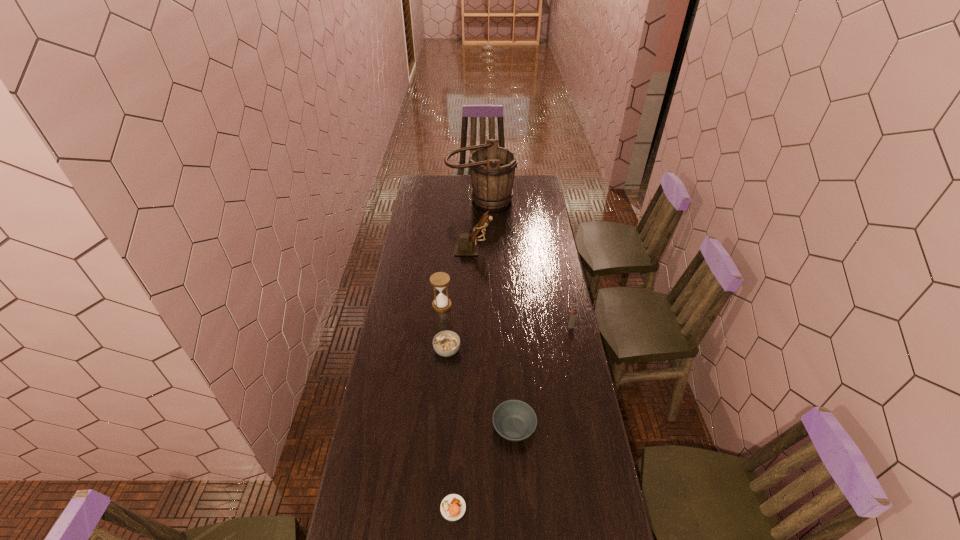
Locate an element on the screen. the right soup bowl is located at coordinates (514, 420).

Find the location of a particular element. The width and height of the screenshot is (960, 540). the second nearest object is located at coordinates (514, 420).

Find the location of `the shortest object`. the shortest object is located at coordinates (453, 507).

I want to click on patty, so click(453, 507).

Where is `free location located on the handle side of the bucket`? free location located on the handle side of the bucket is located at coordinates (481, 241).

Locate an element on the screen. vacant space positioned on the front-facing side of the figurine is located at coordinates (541, 248).

Find the location of a particular element. The height and width of the screenshot is (540, 960). vacant space located 0.340m on the front of the hourglass is located at coordinates (436, 373).

I want to click on vacant space located 0.140m on the back of the rightmost object, so click(566, 303).

The height and width of the screenshot is (540, 960). Find the location of `vacant area situated on the right of the farther soup bowl`. vacant area situated on the right of the farther soup bowl is located at coordinates (480, 350).

Where is `free space located 0.060m on the left of the sixth farthest object`? The image size is (960, 540). free space located 0.060m on the left of the sixth farthest object is located at coordinates (476, 428).